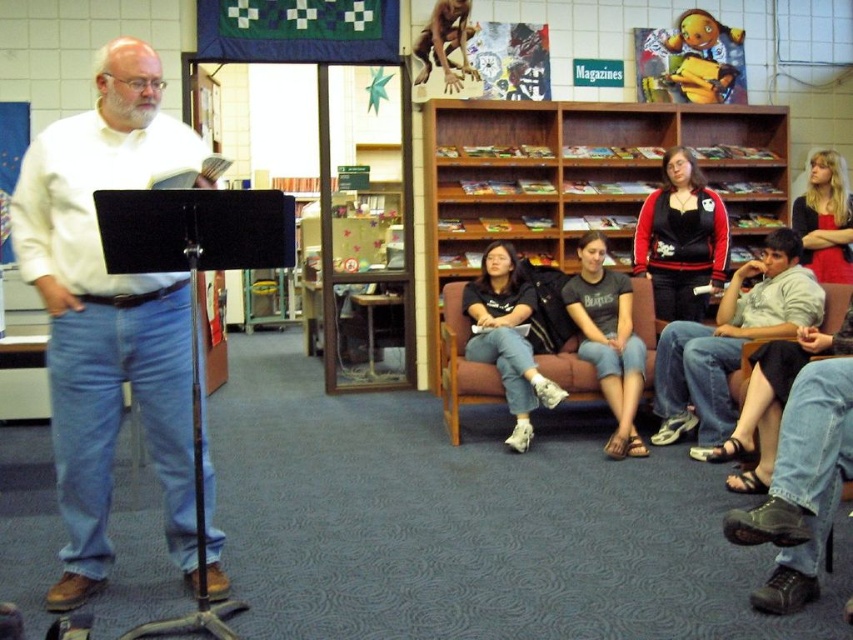
Which is below, wooden bookshelf at center or dark gray t-shirt at center?

Positioned lower is dark gray t-shirt at center.

Find the location of `wooden bookshelf at center`. wooden bookshelf at center is located at coordinates (572, 182).

Between white shirt at left and dark gray t-shirt at center, which one appears on the right side from the viewer's perspective?

Positioned to the right is dark gray t-shirt at center.

Is white shirt at left to the right of dark gray t-shirt at center from the viewer's perspective?

No, white shirt at left is not to the right of dark gray t-shirt at center.

Locate an element on the screen. white shirt at left is located at coordinates (107, 312).

Between wooden bookshelf at center and gray cotton shirt at lower right, which one appears on the right side from the viewer's perspective?

gray cotton shirt at lower right

Is wooden bookshelf at center to the left of gray cotton shirt at lower right from the viewer's perspective?

Indeed, wooden bookshelf at center is positioned on the left side of gray cotton shirt at lower right.

This screenshot has width=853, height=640. What do you see at coordinates (572, 182) in the screenshot?
I see `wooden bookshelf at center` at bounding box center [572, 182].

The image size is (853, 640). Find the location of `wooden bookshelf at center`. wooden bookshelf at center is located at coordinates (572, 182).